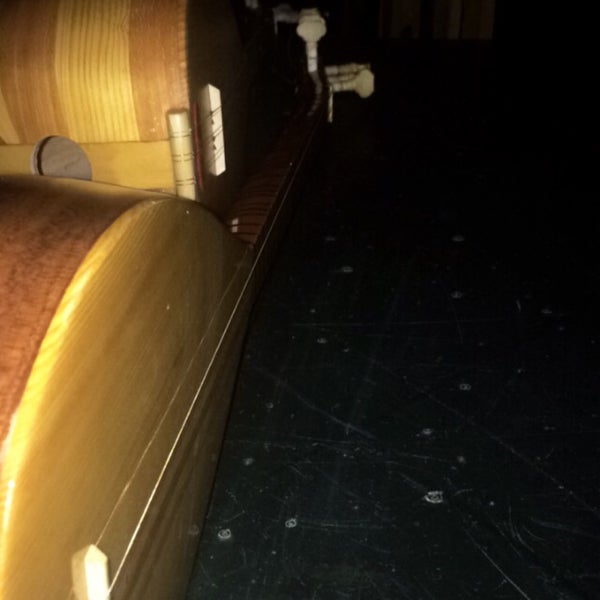
You are a GUI agent. You are given a task and a screenshot of the screen. Output one action in this format:
    pyautogui.click(x=<x>, y=<y>)
    Task: Click on the floor
    
    Given the screenshot: What is the action you would take?
    pyautogui.click(x=436, y=356)